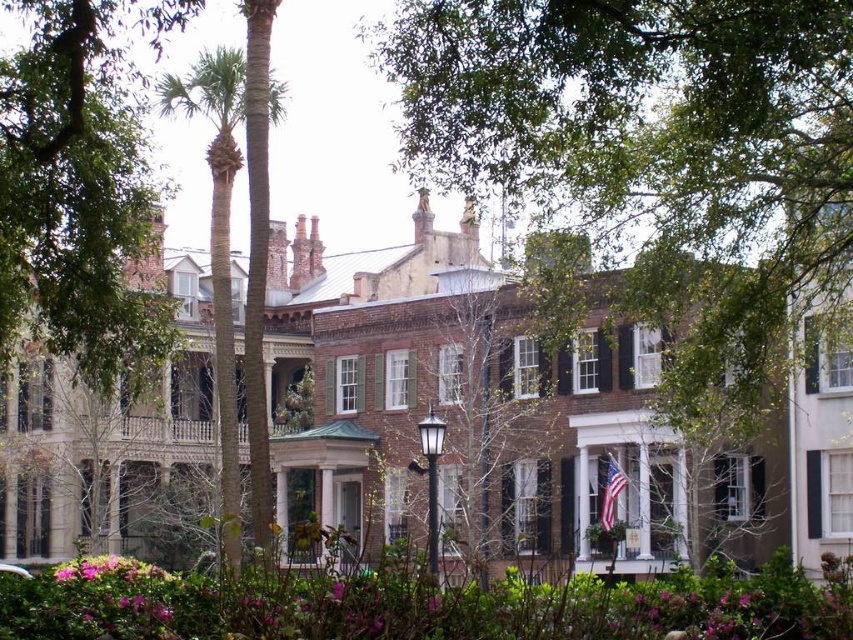
You are a tourist standing on the sidewalk in front of the brown brick mansion at center and the green leafy tree at upper left. Which object is closer to the left side of the street?

The green leafy tree at upper left is closer to the left side of the street because the brown brick mansion at center is to the right of it.